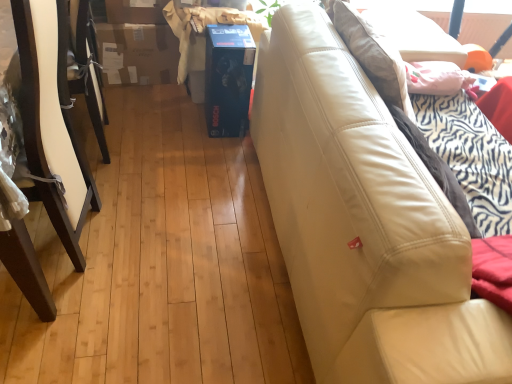
Question: Is point (476, 367) closer or farther from the camera than point (3, 21)?

Choices:
 (A) farther
 (B) closer

Answer: (B)

Question: Would you say beige leather couch at right is to the left or to the right of white painted wood chair at left in the picture?

Choices:
 (A) right
 (B) left

Answer: (A)

Question: Relative to white painted wood chair at left, is beige leather couch at right in front or behind?

Choices:
 (A) front
 (B) behind

Answer: (A)

Question: Considering the positions of white painted wood chair at left and beige leather couch at right in the image, is white painted wood chair at left wider or thinner than beige leather couch at right?

Choices:
 (A) thin
 (B) wide

Answer: (B)

Question: Based on their sizes in the image, would you say white painted wood chair at left is bigger or smaller than beige leather couch at right?

Choices:
 (A) big
 (B) small

Answer: (B)

Question: Would you say white painted wood chair at left is inside or outside beige leather couch at right?

Choices:
 (A) inside
 (B) outside

Answer: (B)

Question: From the image's perspective, is white painted wood chair at left above or below beige leather couch at right?

Choices:
 (A) above
 (B) below

Answer: (A)